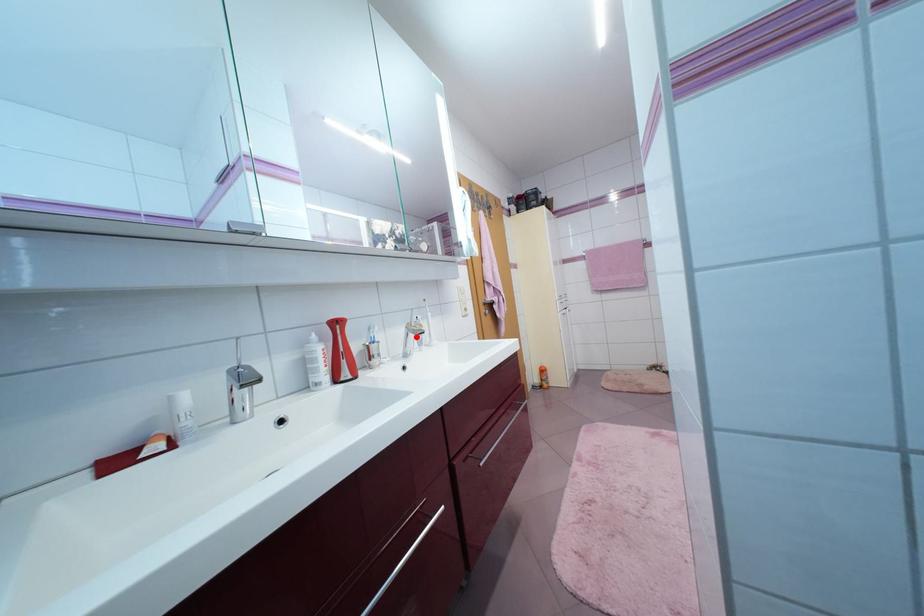
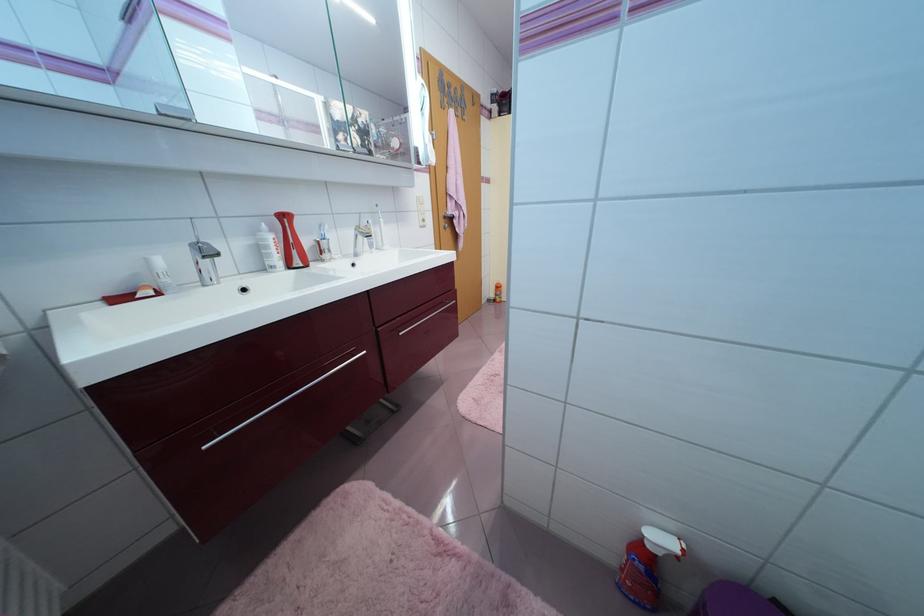
Locate, in the second image, the point that corresponds to the highlighted location in the first image.

(365, 238)